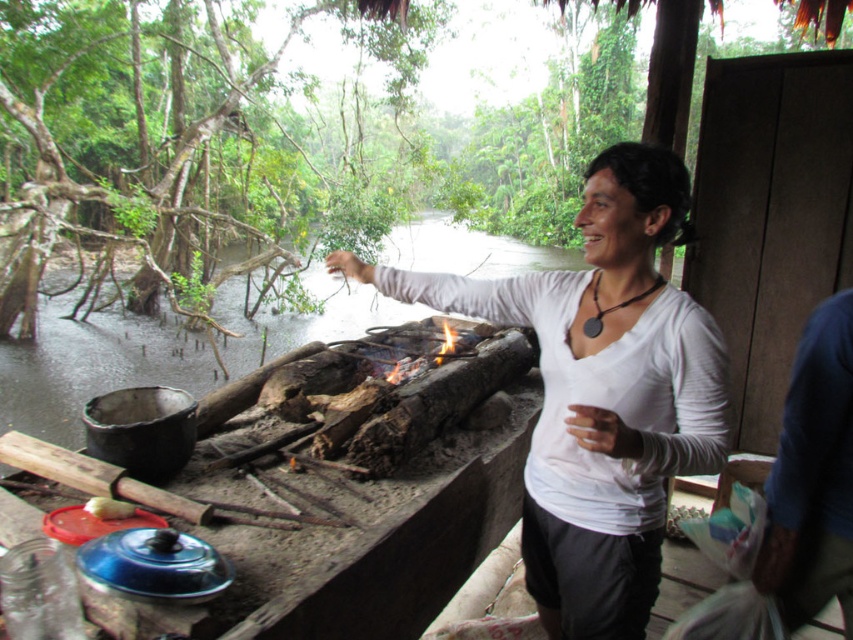
Is white matte shirt at center above blue fabric shirt at right?

Yes, white matte shirt at center is above blue fabric shirt at right.

Does white matte shirt at center have a greater width compared to blue fabric shirt at right?

Indeed, white matte shirt at center has a greater width compared to blue fabric shirt at right.

This screenshot has width=853, height=640. Find the location of `white matte shirt at center`. white matte shirt at center is located at coordinates (601, 392).